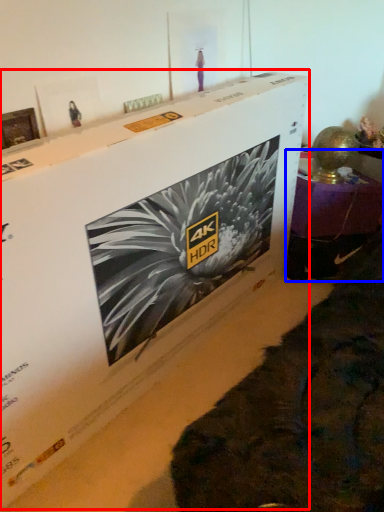
Question: Which object is further to the camera taking this photo, cardboard box (highlighted by a red box) or furniture (highlighted by a blue box)?

Choices:
 (A) cardboard box
 (B) furniture

Answer: (B)